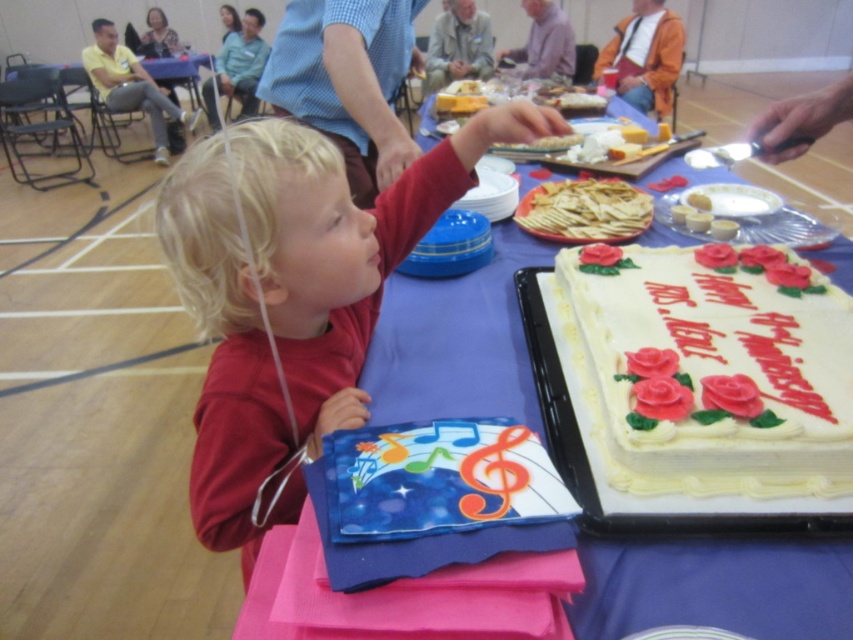
Question: Which of the following is the closest to the observer?

Choices:
 (A) white frosted cake at center
 (B) yellow cake at right
 (C) red cotton shirt at center
 (D) light brown crispy crackers at center

Answer: (A)

Question: Can you confirm if red cotton shirt at center is wider than white frosted cake with red roses at center?

Choices:
 (A) no
 (B) yes

Answer: (B)

Question: Is white frosted cake with red roses at center positioned at the back of white frosted cake at center?

Choices:
 (A) yes
 (B) no

Answer: (A)

Question: Can you confirm if white frosted cake at center is thinner than light brown crispy crackers at center?

Choices:
 (A) yes
 (B) no

Answer: (B)

Question: Considering the real-world distances, which object is closest to the yellow cake at right?

Choices:
 (A) white frosted cake at center
 (B) light brown crispy crackers at center
 (C) red cotton shirt at center

Answer: (B)

Question: Which of the following is the closest to the observer?

Choices:
 (A) white frosted cake at center
 (B) yellow cake at right
 (C) white frosted cake with red roses at center

Answer: (A)